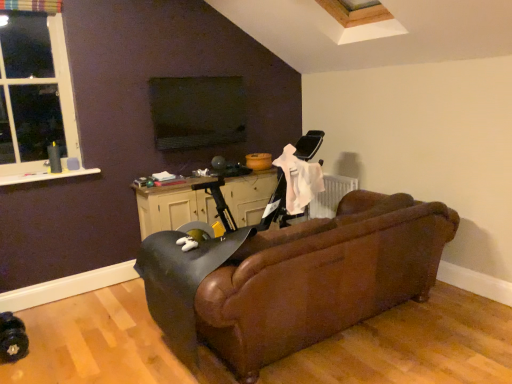
Question: Can you confirm if leather swivel chair at center is positioned to the right of white plastic window at upper left?

Choices:
 (A) yes
 (B) no

Answer: (A)

Question: Does leather swivel chair at center have a greater height compared to white plastic window at upper left?

Choices:
 (A) no
 (B) yes

Answer: (A)

Question: Is leather swivel chair at center smaller than white plastic window at upper left?

Choices:
 (A) no
 (B) yes

Answer: (A)

Question: Is leather swivel chair at center oriented towards white plastic window at upper left?

Choices:
 (A) no
 (B) yes

Answer: (A)

Question: Is leather swivel chair at center directly adjacent to white plastic window at upper left?

Choices:
 (A) no
 (B) yes

Answer: (A)

Question: Is leather swivel chair at center bigger or smaller than brown leather couch at center?

Choices:
 (A) big
 (B) small

Answer: (B)

Question: From a real-world perspective, relative to brown leather couch at center, is leather swivel chair at center vertically above or below?

Choices:
 (A) above
 (B) below

Answer: (A)

Question: Considering the relative positions of leather swivel chair at center and brown leather couch at center in the image provided, is leather swivel chair at center to the left or to the right of brown leather couch at center?

Choices:
 (A) left
 (B) right

Answer: (A)

Question: From the image's perspective, is leather swivel chair at center positioned above or below brown leather couch at center?

Choices:
 (A) below
 (B) above

Answer: (A)

Question: Choose the correct answer: Is brown leather couch at center inside leather swivel chair at center or outside it?

Choices:
 (A) outside
 (B) inside

Answer: (A)

Question: Is brown leather couch at center bigger or smaller than leather swivel chair at center?

Choices:
 (A) big
 (B) small

Answer: (A)

Question: Considering the positions of point (219, 292) and point (163, 324), is point (219, 292) closer or farther from the camera than point (163, 324)?

Choices:
 (A) closer
 (B) farther

Answer: (A)

Question: Is brown leather couch at center taller or shorter than leather swivel chair at center?

Choices:
 (A) short
 (B) tall

Answer: (B)

Question: Is black matte table at center to the left or to the right of white plastic window at upper left in the image?

Choices:
 (A) left
 (B) right

Answer: (B)

Question: Is black matte table at center wider or thinner than white plastic window at upper left?

Choices:
 (A) thin
 (B) wide

Answer: (B)